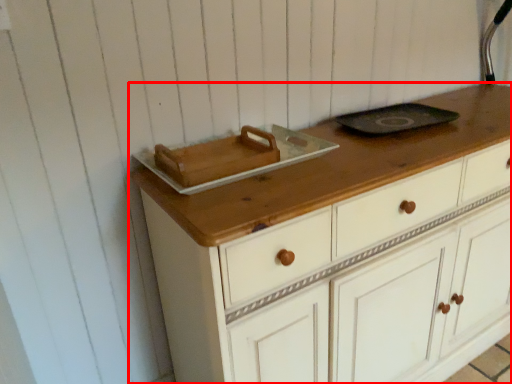
Question: From the image's perspective, where is chest of drawers (annotated by the red box) located relative to appliance?

Choices:
 (A) above
 (B) below

Answer: (B)